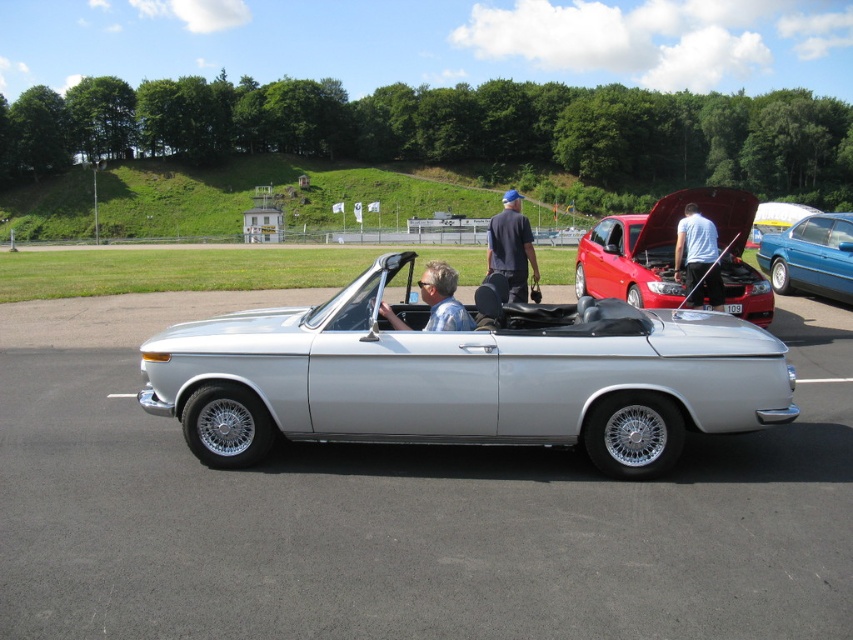
You are a photographer at the car show and want to take a photo of both the shiny red car at center and the blue denim jeans at center. Which object should you focus on first if you want to capture them both in the same frame without moving the camera?

The shiny red car at center is positioned on the left side of blue denim jeans at center, so you should focus on the shiny red car at center first to ensure both objects are in the frame.

You are standing at the origin point in the car show scene. The shiny red car at center is located at coordinates 0.398, 0.789. If you want to walk directly towards it, which direction should you head?

The shiny red car at center is located at coordinates (672, 253). Since the x and y coordinates are both positive, you should head towards the northeast direction to reach it.

You are a photographer at the car show and want to capture a photo that includes both the blue metallic sedan at center and the white cotton shirt at center. Based on their positions, which object should you focus on first to ensure both are in the frame?

The blue metallic sedan at center is located above the white cotton shirt at center, so you should focus on the white cotton shirt at center first to ensure both are in the frame.